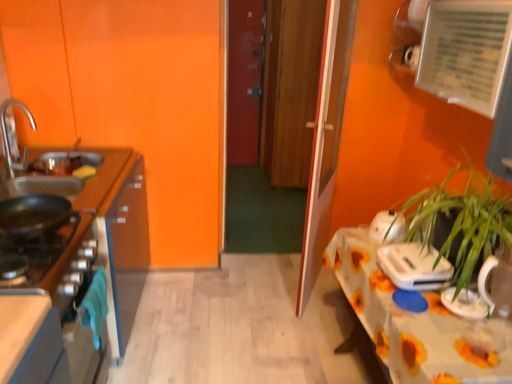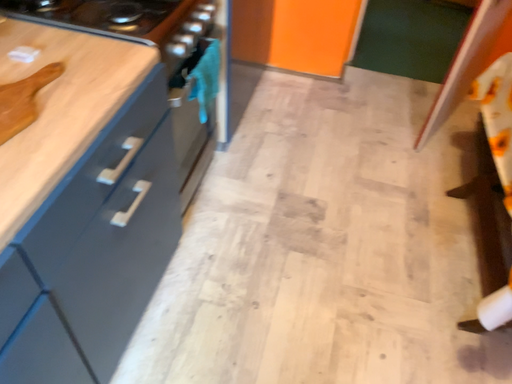
Question: How did the camera likely rotate when shooting the video?

Choices:
 (A) rotated upward
 (B) rotated downward

Answer: (B)